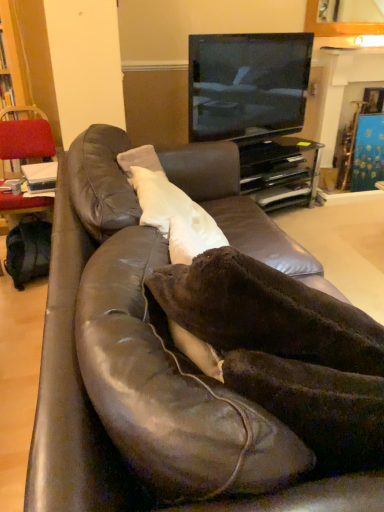
Question: Is metallic gold fireplace at upper center located outside brown leather couch at center?

Choices:
 (A) yes
 (B) no

Answer: (A)

Question: From the image's perspective, is metallic gold fireplace at upper center below brown leather couch at center?

Choices:
 (A) no
 (B) yes

Answer: (A)

Question: Are metallic gold fireplace at upper center and brown leather couch at center located far from each other?

Choices:
 (A) yes
 (B) no

Answer: (A)

Question: Is brown leather couch at center inside metallic gold fireplace at upper center?

Choices:
 (A) no
 (B) yes

Answer: (A)

Question: Is metallic gold fireplace at upper center smaller than brown leather couch at center?

Choices:
 (A) no
 (B) yes

Answer: (B)

Question: Based on their sizes in the image, would you say black glossy entertainment center at upper center is bigger or smaller than metallic gold fireplace at upper center?

Choices:
 (A) big
 (B) small

Answer: (B)

Question: Relative to metallic gold fireplace at upper center, is black glossy entertainment center at upper center in front or behind?

Choices:
 (A) behind
 (B) front

Answer: (B)

Question: From a real-world perspective, is black glossy entertainment center at upper center physically located above or below metallic gold fireplace at upper center?

Choices:
 (A) above
 (B) below

Answer: (B)

Question: Looking at their shapes, would you say black glossy entertainment center at upper center is wider or thinner than metallic gold fireplace at upper center?

Choices:
 (A) wide
 (B) thin

Answer: (B)

Question: Is black glossy entertainment center at upper center spatially inside velvet red chair at left, or outside of it?

Choices:
 (A) inside
 (B) outside

Answer: (B)

Question: Is black glossy entertainment center at upper center wider or thinner than velvet red chair at left?

Choices:
 (A) wide
 (B) thin

Answer: (B)

Question: Is black glossy entertainment center at upper center to the left or to the right of velvet red chair at left in the image?

Choices:
 (A) right
 (B) left

Answer: (A)

Question: In the image, is black glossy entertainment center at upper center positioned in front of or behind velvet red chair at left?

Choices:
 (A) behind
 (B) front

Answer: (A)

Question: Would you say black glossy tv at upper center is inside or outside velvet red chair at left?

Choices:
 (A) outside
 (B) inside

Answer: (A)

Question: Does point (236, 97) appear closer or farther from the camera than point (8, 150)?

Choices:
 (A) farther
 (B) closer

Answer: (A)